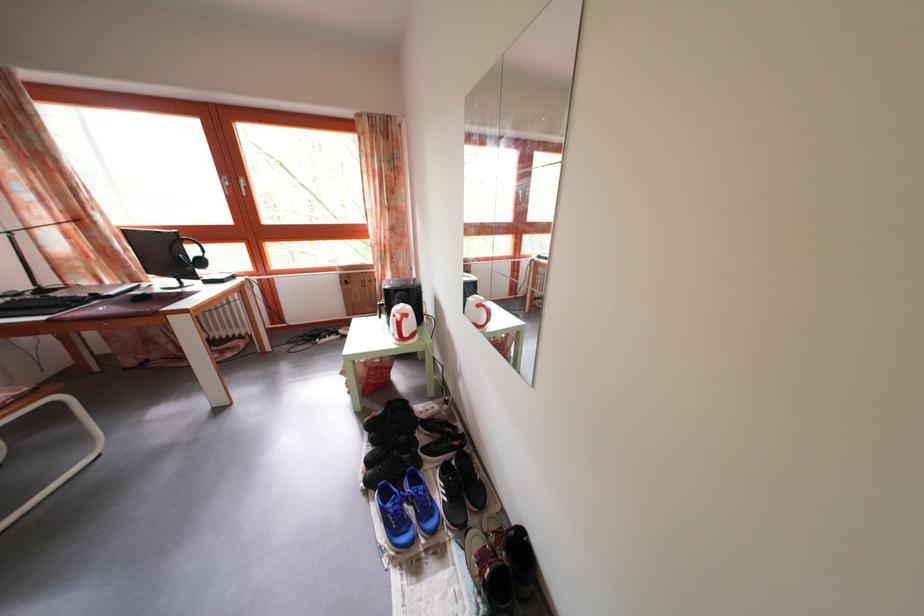
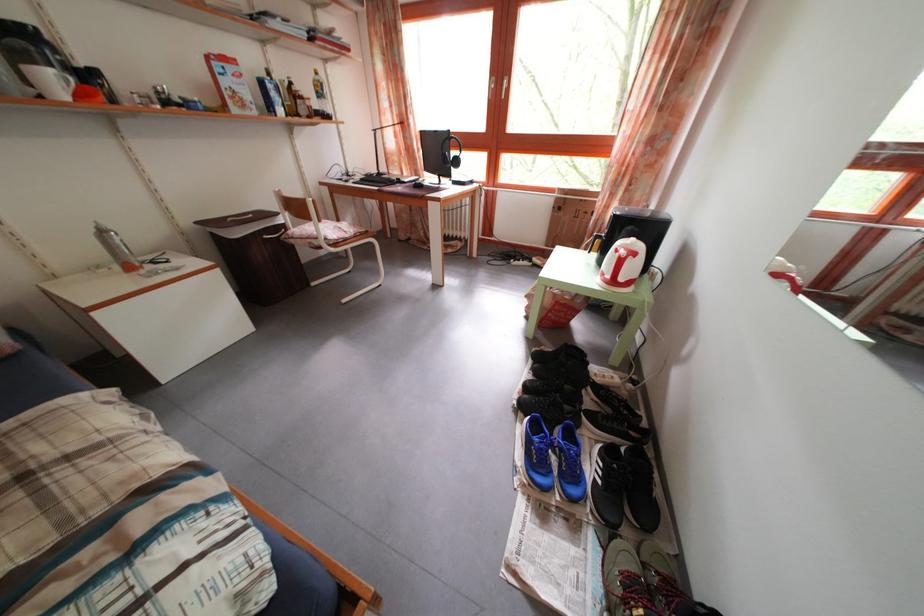
In the second image, find the point that corresponds to [392,503] in the first image.

(542, 435)